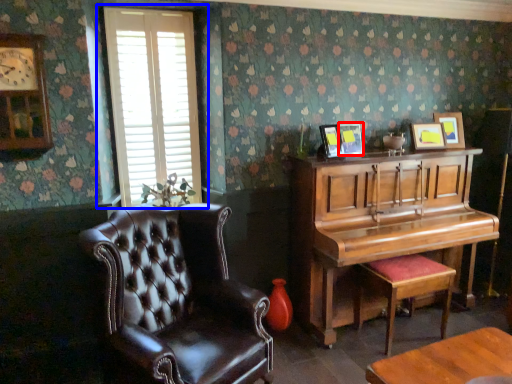
Question: Among these objects, which one is nearest to the camera, picture frame (highlighted by a red box) or window (highlighted by a blue box)?

Choices:
 (A) picture frame
 (B) window

Answer: (B)